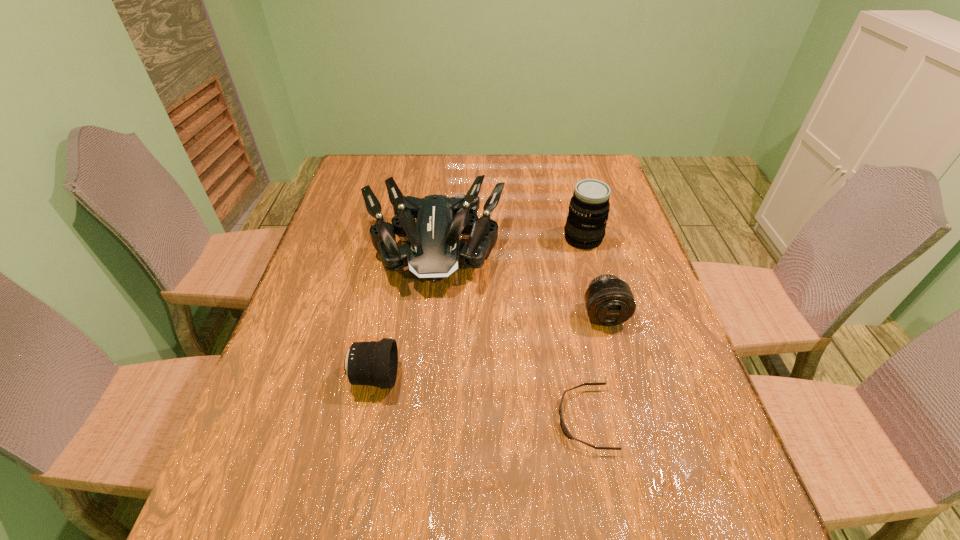
Identify the location of the tallest object. This screenshot has width=960, height=540. (586, 222).

Identify the location of the tallest telephoto lens. (586, 222).

This screenshot has width=960, height=540. In order to click on the fourth shortest object in this screenshot , I will do `click(434, 251)`.

At what (x,y) coordinates should I click in order to perform the action: click on the second nearest telephoto lens. Please return your answer as a coordinate pair (x, y). The height and width of the screenshot is (540, 960). Looking at the image, I should click on (609, 301).

Find the location of a particular element. The height and width of the screenshot is (540, 960). the nearest telephoto lens is located at coordinates pos(372,363).

Find the location of a particular element. This screenshot has width=960, height=540. the shortest object is located at coordinates (562, 424).

The image size is (960, 540). I want to click on free region located 0.320m on the front of the tallest telephoto lens, so click(x=611, y=341).

Locate an element on the screen. free space located on the right of the drone is located at coordinates (526, 248).

At what (x,y) coordinates should I click in order to perform the action: click on vacant space situated 0.230m on the front-facing side of the second farthest telephoto lens. Please return your answer as a coordinate pair (x, y). Looking at the image, I should click on (633, 420).

At what (x,y) coordinates should I click in order to perform the action: click on vacant space located at the front element of the nearest telephoto lens. Please return your answer as a coordinate pair (x, y). The width and height of the screenshot is (960, 540). Looking at the image, I should click on (508, 377).